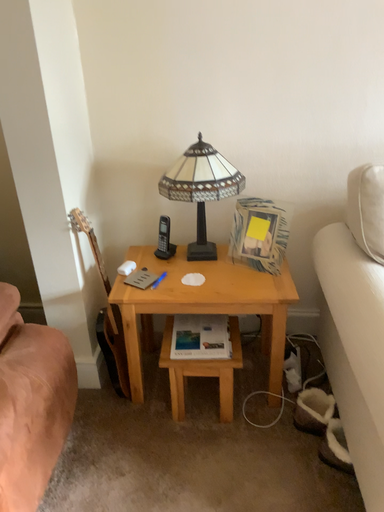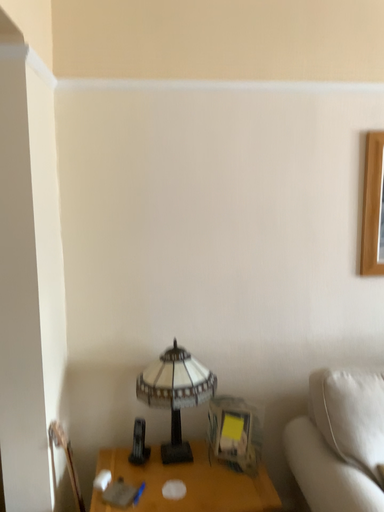
Question: Which way did the camera rotate in the video?

Choices:
 (A) rotated right
 (B) rotated left

Answer: (A)